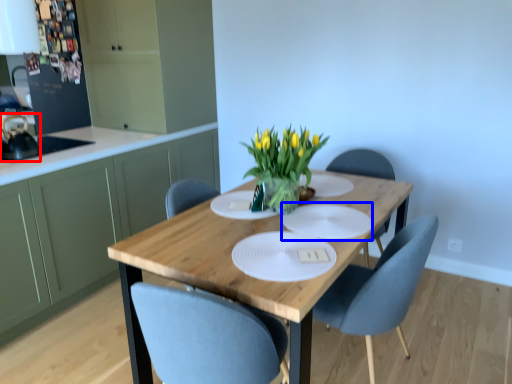
Question: Which of the following is the farthest to the observer, appliance (highlighted by a red box) or glass plate (highlighted by a blue box)?

Choices:
 (A) appliance
 (B) glass plate

Answer: (A)